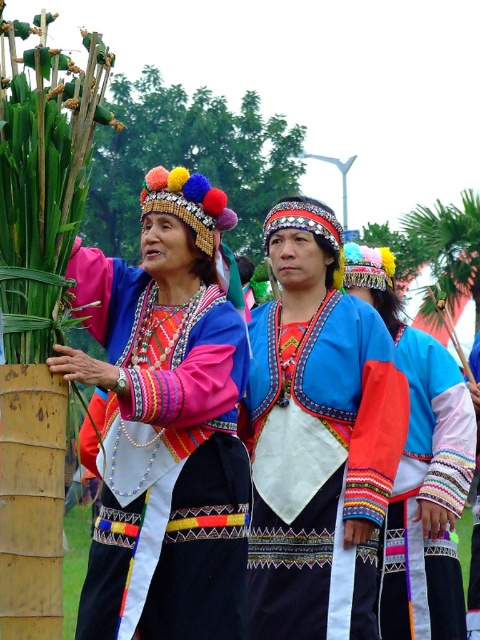
Can you confirm if blue satin blouse at center is wider than multicolored woven fabric at center?

Yes.

Is blue satin blouse at center to the right of multicolored woven fabric at center from the viewer's perspective?

No, blue satin blouse at center is not to the right of multicolored woven fabric at center.

The height and width of the screenshot is (640, 480). I want to click on blue satin blouse at center, so click(x=319, y=467).

I want to click on blue satin blouse at center, so click(319, 467).

Does matte black dress at center appear on the left side of blue satin blouse at center?

Yes, matte black dress at center is to the left of blue satin blouse at center.

Does matte black dress at center have a lesser height compared to blue satin blouse at center?

Indeed, matte black dress at center has a lesser height compared to blue satin blouse at center.

Describe the element at coordinates (166, 460) in the screenshot. The height and width of the screenshot is (640, 480). I see `matte black dress at center` at that location.

Identify the location of matte black dress at center. (166, 460).

Consider the image. Is matte black dress at center to the right of multicolored woven fabric at center from the viewer's perspective?

In fact, matte black dress at center is to the left of multicolored woven fabric at center.

Who is more forward, (214, 536) or (462, 384)?

Point (214, 536) is in front.

I want to click on matte black dress at center, so click(166, 460).